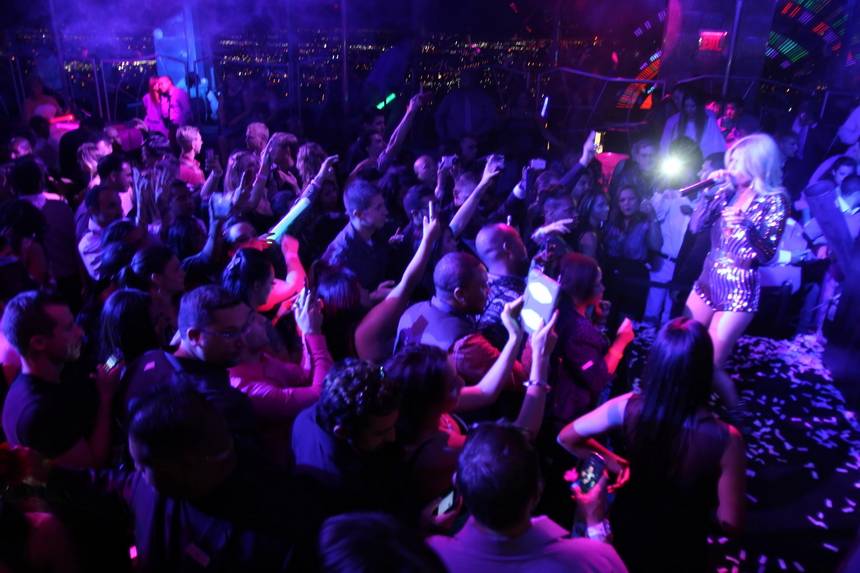
The width and height of the screenshot is (860, 573). I want to click on black floor, so click(x=93, y=524).